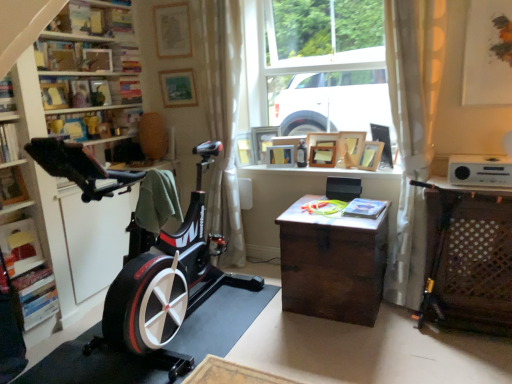
Identify the location of free point in front of beige dotted curtain at right, which is the 1th curtain from right to left. (397, 329).